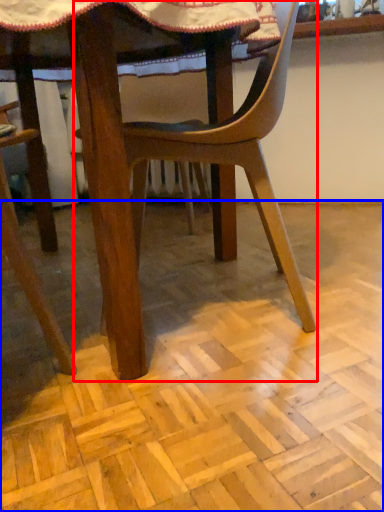
Question: Which of the following is the closest to the observer, chair (highlighted by a red box) or plywood (highlighted by a blue box)?

Choices:
 (A) chair
 (B) plywood

Answer: (B)